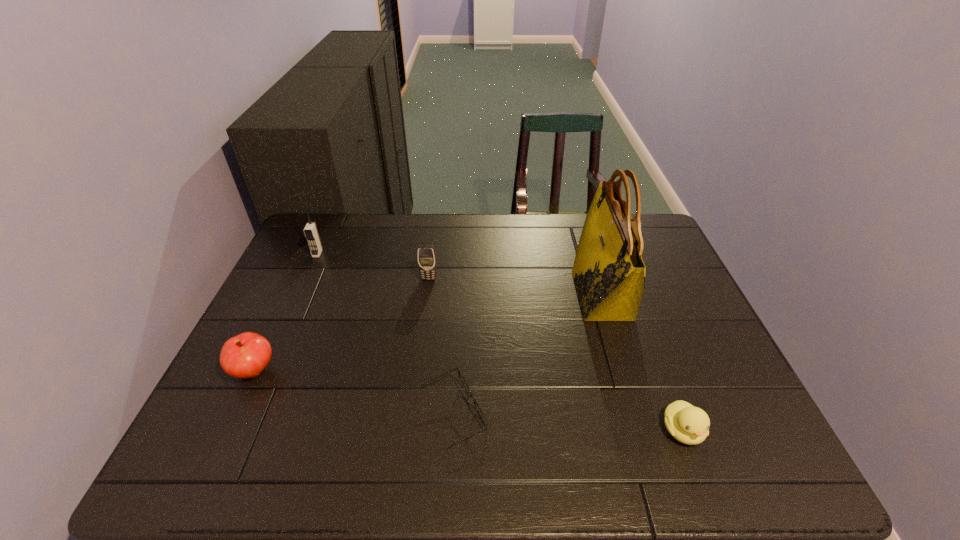
This screenshot has width=960, height=540. In order to click on vacant position located 0.240m on the front-facing side of the tote bag in this screenshot , I will do `click(492, 295)`.

This screenshot has width=960, height=540. Identify the location of vacant space located on the front-facing side of the left cellular telephone. (308, 274).

The width and height of the screenshot is (960, 540). What are the coordinates of `vacant space situated on the front face of the right cellular telephone` in the screenshot? It's located at (418, 367).

What are the coordinates of `vacant space located on the right of the apple` in the screenshot? It's located at (436, 371).

You are a GUI agent. You are given a task and a screenshot of the screen. Output one action in this format:
    pyautogui.click(x=<x>, y=<y>)
    Task: Click on the free space located at the beak of the duckling
    
    Given the screenshot: What is the action you would take?
    pyautogui.click(x=700, y=477)

Identify the location of vacant position located with the lenses facing outward on the spectacles. This screenshot has height=540, width=960. (625, 414).

Image resolution: width=960 pixels, height=540 pixels. Find the location of `tote bag located at the far edge`. tote bag located at the far edge is located at coordinates (609, 274).

Where is `cellular telephone that is positioned at the far edge`? cellular telephone that is positioned at the far edge is located at coordinates click(311, 233).

What are the coordinates of `duckling located in the near edge section of the desktop` in the screenshot? It's located at (690, 425).

I want to click on spectacles at the near edge, so click(462, 379).